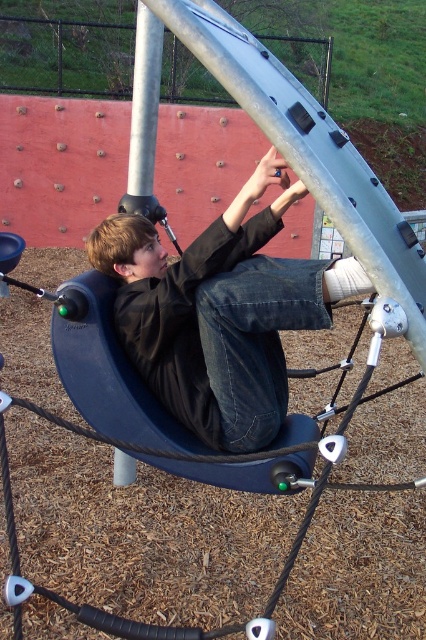
You are a photographer trying to capture the child in the center wearing the matte black jacket at center. You want to ensure the jacket is visible against the silver metallic pole at upper center. Based on the scene, will the jacket appear wider than the pole in your photo?

The matte black jacket at center has a larger width than the silver metallic pole at upper center, so yes, the jacket will appear wider than the pole in the photo.

You are a photographer trying to capture a photo of the child playing. You notice the matte black jacket at center and the silver metallic pole at upper center in your viewfinder. Which object should you focus on if you want to highlight something larger in your photo?

The matte black jacket at center has a larger size compared to the silver metallic pole at upper center, so you should focus on the matte black jacket at center to highlight the larger object in your photo.

You are standing at the playground and see two points marked on the climbing structure. Which point is closer to you, point (175, 333) or point (134, 138)?

Point (175, 333) is closer to the viewer than point (134, 138).